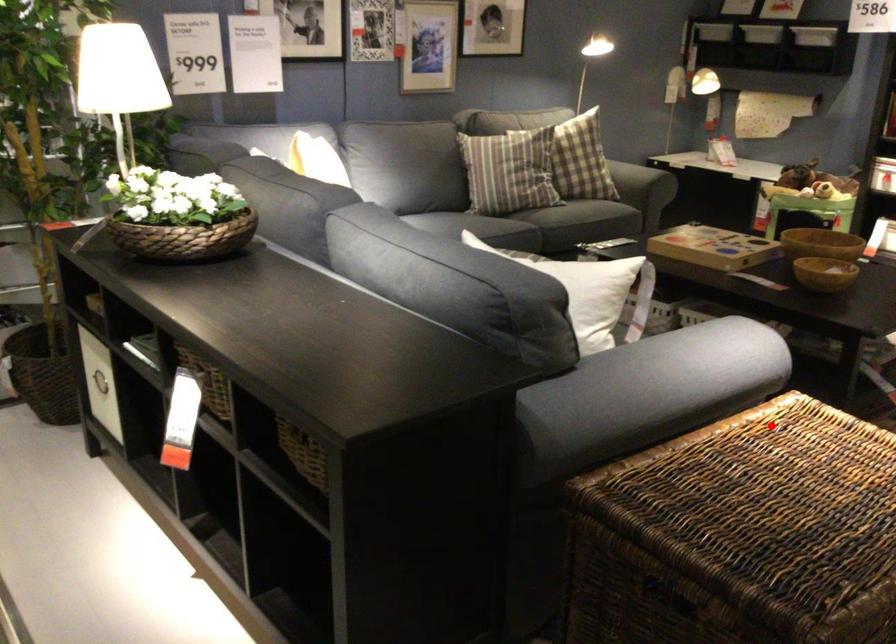
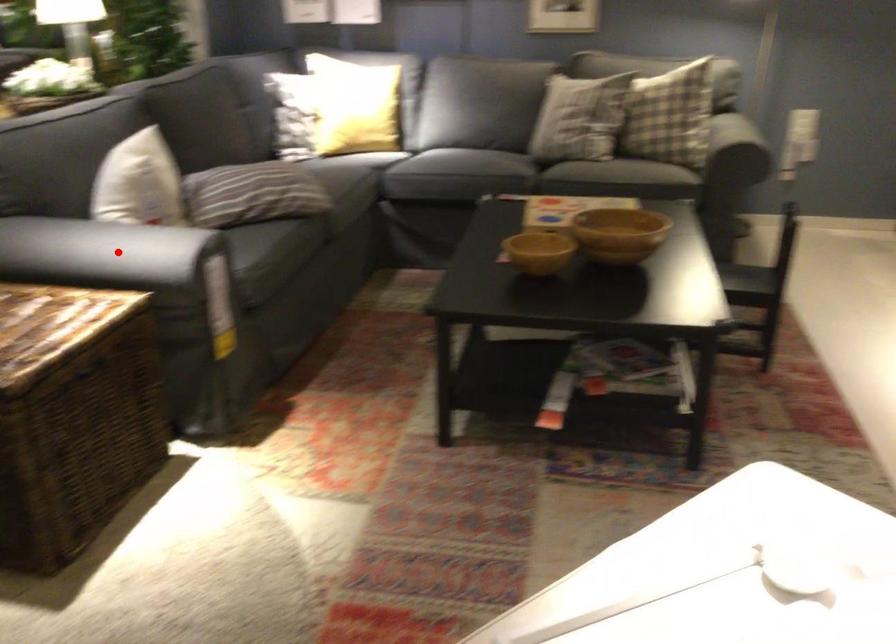
I am providing you with two images of the same scene from different viewpoints. A red point is marked on the first image and another point is marked on the second image. Does the point marked in image1 correspond to the same location as the one in image2?

No